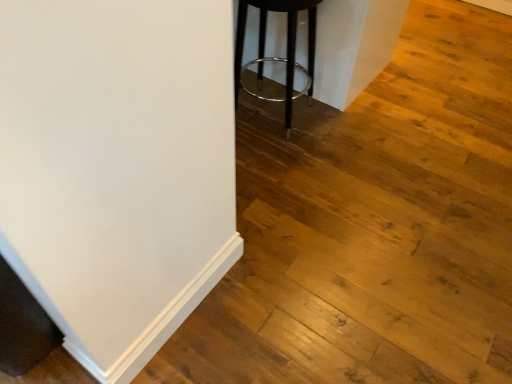
Question: Should I look upward or downward to see black metal stool at center?

Choices:
 (A) down
 (B) up

Answer: (B)